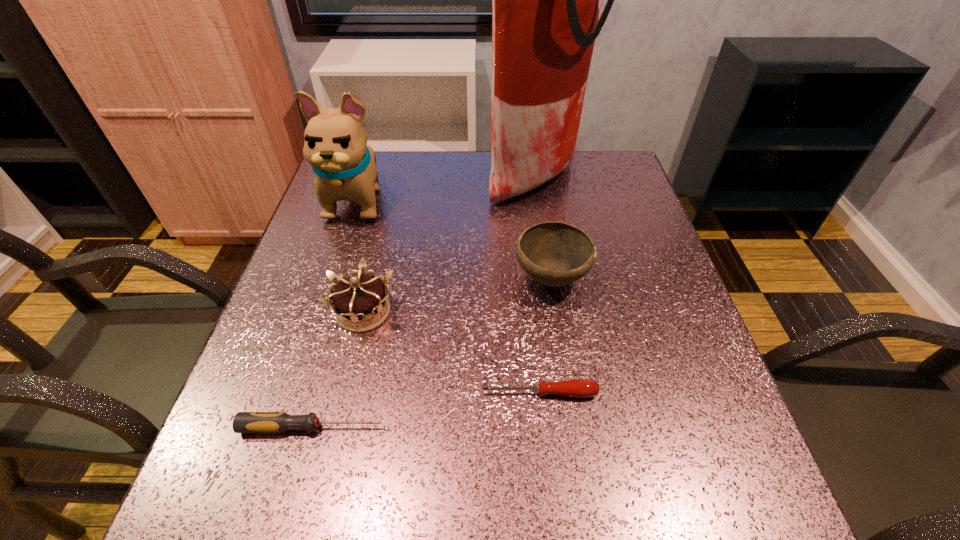
You are a GUI agent. You are given a task and a screenshot of the screen. Output one action in this format:
    pyautogui.click(x=<x>, y=<y>)
    Task: Click on the grocery bag
    The height and width of the screenshot is (540, 960).
    Given the screenshot: What is the action you would take?
    pyautogui.click(x=546, y=0)

At what (x,y) coordinates should I click in order to perform the action: click on puppy. Please return your answer as a coordinate pair (x, y). The height and width of the screenshot is (540, 960). Looking at the image, I should click on (335, 144).

The height and width of the screenshot is (540, 960). I want to click on crown, so click(362, 299).

The width and height of the screenshot is (960, 540). Identify the location of bowl. (555, 254).

Identify the location of the left screwdriver. The height and width of the screenshot is (540, 960). (244, 422).

Identify the location of the nearest object. This screenshot has height=540, width=960. (244, 422).

Where is `the second nearest object`? the second nearest object is located at coordinates (579, 388).

The width and height of the screenshot is (960, 540). I want to click on the farther screwdriver, so click(x=579, y=388).

Image resolution: width=960 pixels, height=540 pixels. Identify the location of vacant space located 0.370m on the front of the tallest object. coord(556,320).

Locate an element on the screen. The height and width of the screenshot is (540, 960). vacant space located 0.140m on the face of the second tallest object is located at coordinates (334, 271).